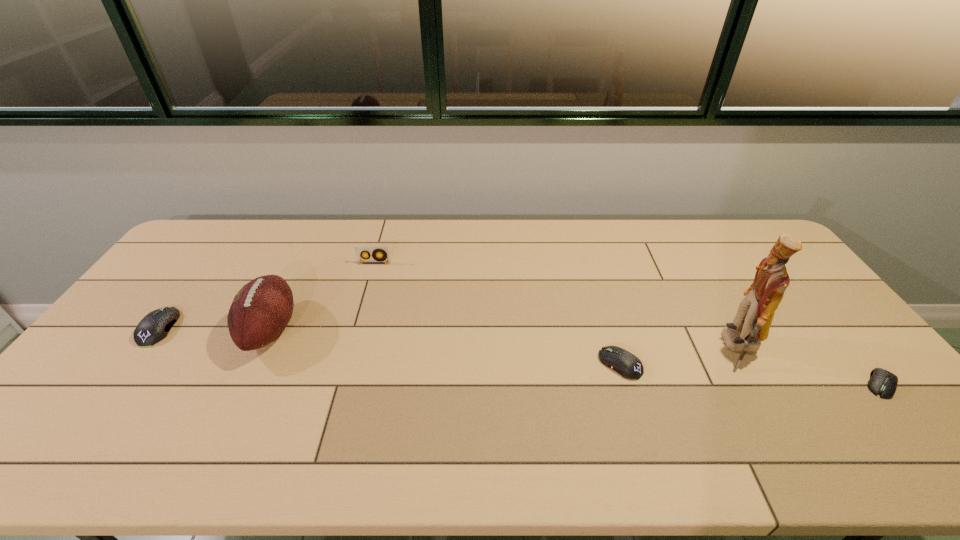
You are a GUI agent. You are given a task and a screenshot of the screen. Output one action in this format:
    pyautogui.click(x=<x>, y=<y>)
    Task: Click on the second object from left to right
    The height and width of the screenshot is (540, 960).
    Given the screenshot: What is the action you would take?
    pyautogui.click(x=260, y=311)

Identify the location of football (American). (260, 311).

This screenshot has width=960, height=540. I want to click on free space located on the back of the leftmost object, so click(224, 240).

Identify the location of vacant space located 0.160m on the right of the second shortest object. The image size is (960, 540). (701, 364).

At what (x,y) coordinates should I click in order to perform the action: click on blank space located 0.340m on the left of the shortest computer equipment. Please return your answer as a coordinate pair (x, y). This screenshot has height=540, width=960. Looking at the image, I should click on (732, 384).

Locate an element on the screen. The image size is (960, 540). vacant space located at the front of the third object from left to right with visible reels is located at coordinates (350, 347).

Identify the location of vacant area situated 0.360m on the front-facing side of the nutcracker. The image size is (960, 540). (590, 348).

I want to click on vacant point located on the front-facing side of the nutcracker, so click(x=695, y=348).

You are a GUI agent. You are given a task and a screenshot of the screen. Output one action in this format:
    pyautogui.click(x=<x>, y=<y>)
    Task: Click on the vacant area located 0.160m on the front-facing side of the nutcracker
    
    Given the screenshot: What is the action you would take?
    pyautogui.click(x=662, y=348)

At what (x,y) coordinates should I click in order to perform the action: click on vacant space situated on the front of the second tallest object. Please return your answer as a coordinate pair (x, y). Looking at the image, I should click on 233,408.